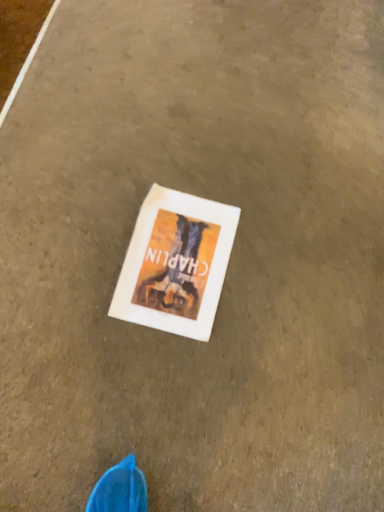
Where is `vacant area on top of white paper book at center (from a real-world perspective)`? vacant area on top of white paper book at center (from a real-world perspective) is located at coordinates (177, 259).